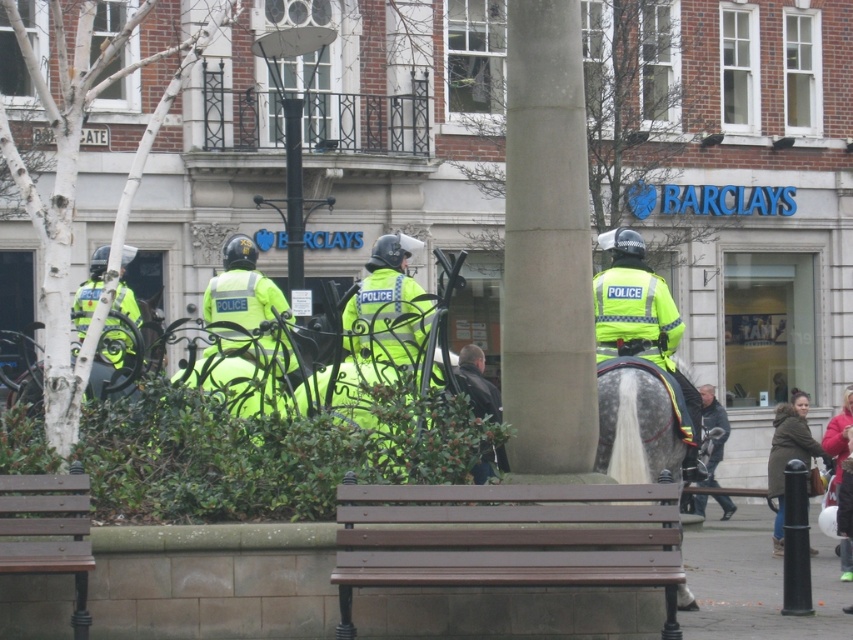
Consider the image. You are a delivery person trying to place a large package on the ground in the public square. The package is as wide as the dark brown leather jacket at center. Can you place the package entirely on the concrete at center without any part hanging off?

The concrete at center has a width less than the dark brown leather jacket at center. Since the package is as wide as the jacket, it will not fit entirely on the concrete at center without part hanging off.

In the scene shown: You are a pedestrian standing in the public square in front of the Barclays bank building. You see a concrete at center and a dark brown leather jacket at center. Which object is positioned to the right of the other?

The concrete at center is to the right of the dark brown leather jacket at center.